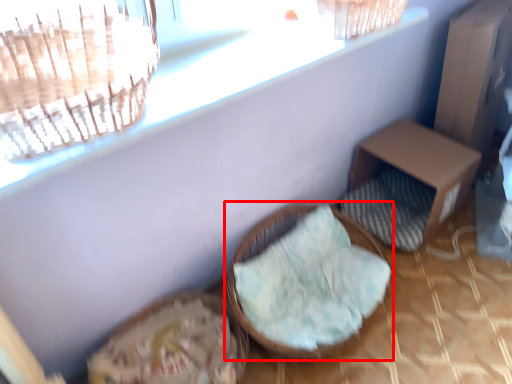
Question: From the image, what is the correct spatial relationship of furniture (annotated by the red box) in relation to furniture?

Choices:
 (A) right
 (B) left

Answer: (B)